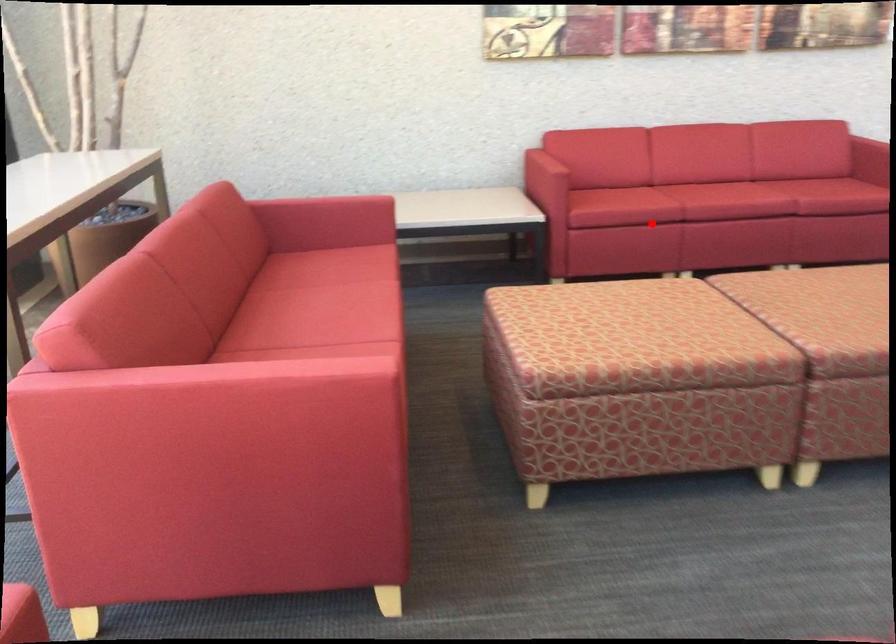
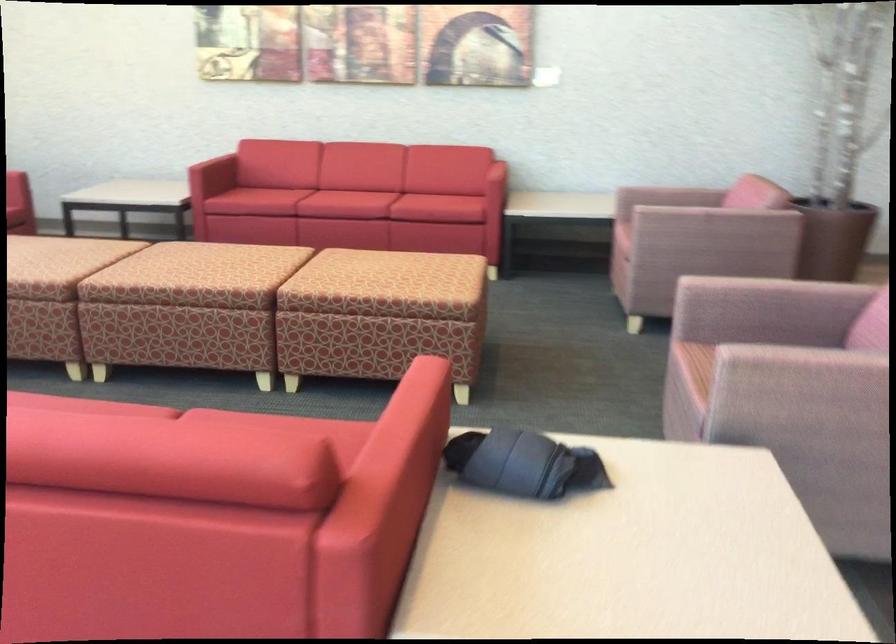
Question: I am providing you with two images of the same scene from different viewpoints. Given a red point in image1, look at the same physical point in image2. Is it:

Choices:
 (A) Closer to the viewpoint
 (B) Farther from the viewpoint

Answer: (B)